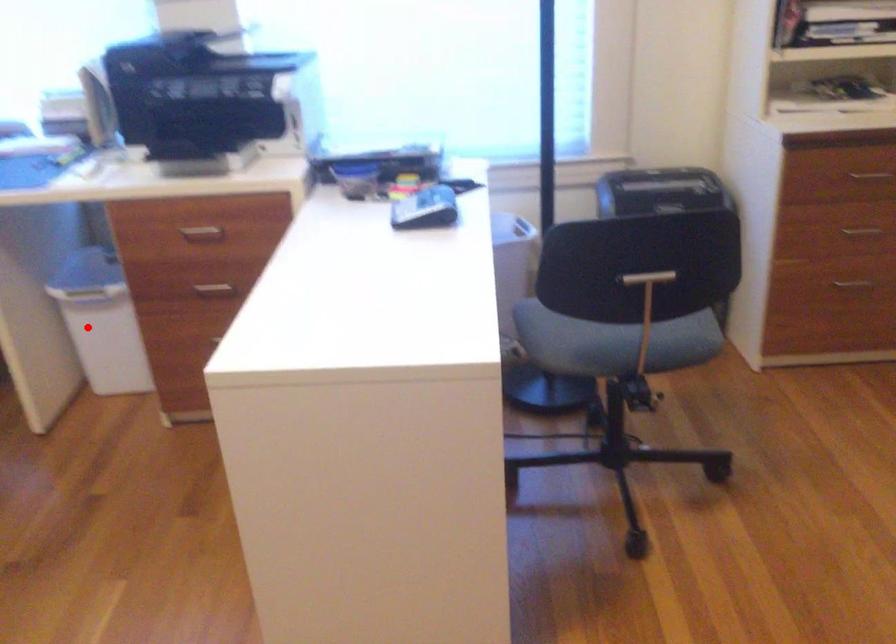
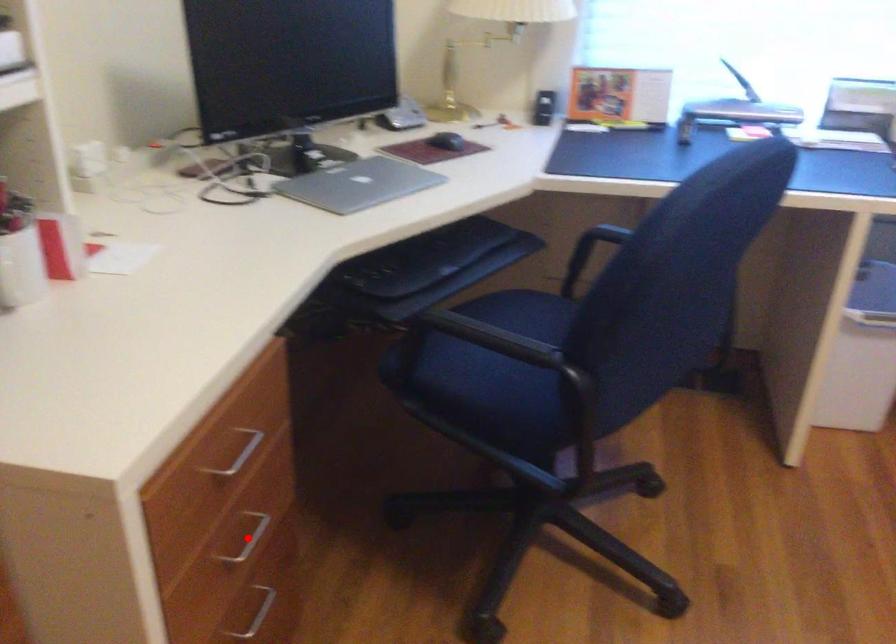
I am providing you with two images of the same scene from different viewpoints. A red point is marked on the first image and another point is marked on the second image. Is the red point in image1 aligned with the point shown in image2?

No